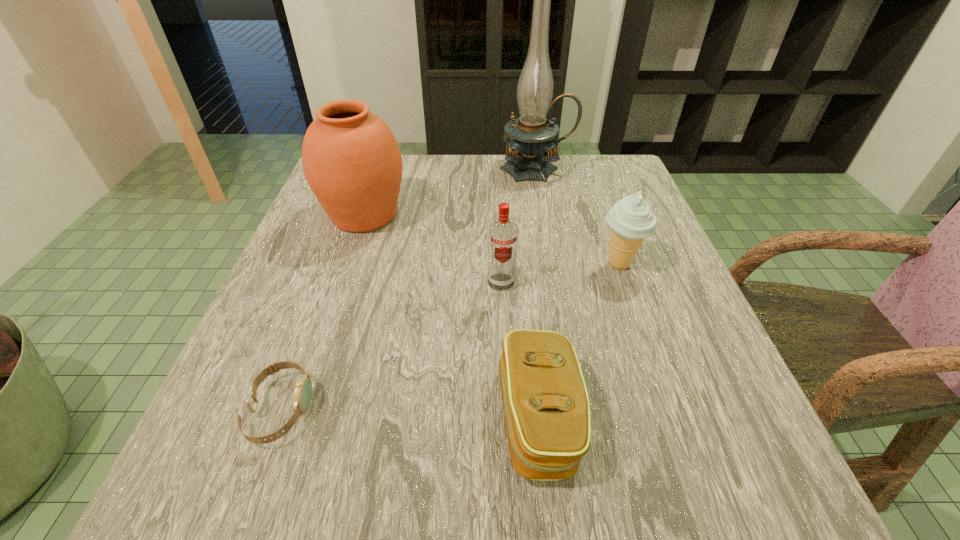
You are a GUI agent. You are given a task and a screenshot of the screen. Output one action in this format:
    pyautogui.click(x=<x>, y=<y>)
    Task: Click on the free space at the near left corner
    The image size is (960, 540).
    Given the screenshot: What is the action you would take?
    pyautogui.click(x=190, y=451)

You are a GUI agent. You are given a task and a screenshot of the screen. Output one action in this format:
    pyautogui.click(x=<x>, y=<y>)
    Task: Click on the blank space at the far right corner
    
    Given the screenshot: What is the action you would take?
    pyautogui.click(x=643, y=195)

This screenshot has width=960, height=540. In order to click on vacant space at the near right corner of the desktop in this screenshot , I will do `click(704, 481)`.

I want to click on vacant space that's between the urn and the tallest object, so click(450, 192).

This screenshot has height=540, width=960. Find the location of `free spot between the vodka and the farthest object`. free spot between the vodka and the farthest object is located at coordinates (518, 226).

You are a GUI agent. You are given a task and a screenshot of the screen. Output one action in this format:
    pyautogui.click(x=<x>, y=<y>)
    Task: Click on the vacant space that is in between the icecream and the second shortest object
    
    Given the screenshot: What is the action you would take?
    pyautogui.click(x=579, y=341)

Where is `empty space that is in between the watch and the fifth shortest object`? empty space that is in between the watch and the fifth shortest object is located at coordinates coord(323,312).

Locate an element on the screen. The width and height of the screenshot is (960, 540). vacant space that's between the vodka and the oil lamp is located at coordinates (518, 226).

Locate an element on the screen. free space between the clutch bag and the shortest object is located at coordinates click(410, 414).

At what (x,y) coordinates should I click in order to perform the action: click on free point between the second farthest object and the shortest object. Please return your answer as a coordinate pair (x, y). This screenshot has width=960, height=540. Looking at the image, I should click on (323, 312).